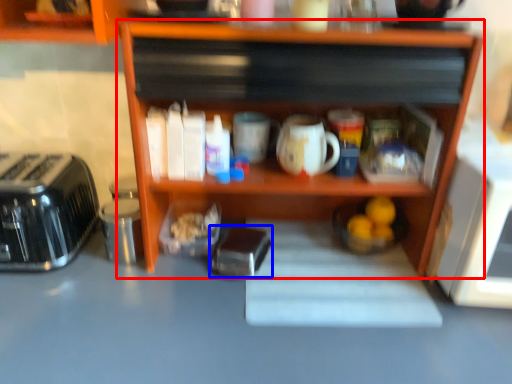
Question: Which point is further to the camera, shelf (highlighted by a red box) or appliance (highlighted by a blue box)?

Choices:
 (A) shelf
 (B) appliance

Answer: (B)